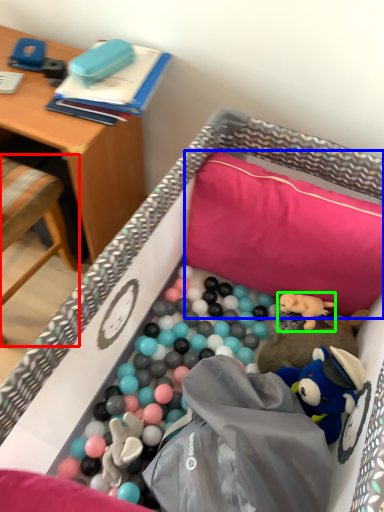
Question: Which object is the closest to the chair (highlighted by a red box)? Choose among these: pillow (highlighted by a blue box) or toy (highlighted by a green box).

Choices:
 (A) pillow
 (B) toy

Answer: (A)